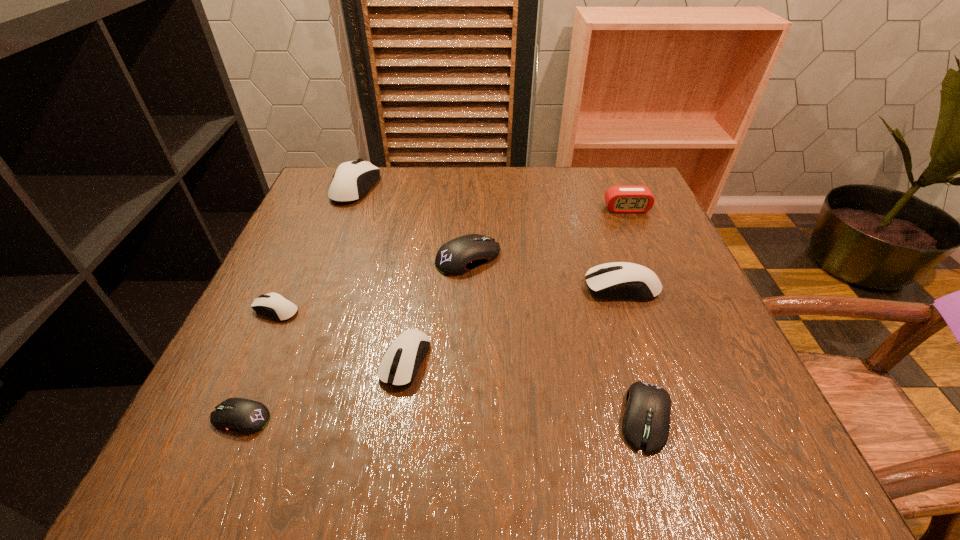
The image size is (960, 540). What are the coordinates of `alarm clock that is at the far edge` in the screenshot? It's located at (619, 199).

Identify the location of alarm clock at the right edge. This screenshot has width=960, height=540. (619, 199).

Image resolution: width=960 pixels, height=540 pixels. I want to click on object that is positioned at the far left corner, so click(x=352, y=180).

Find the location of a particular element. This screenshot has height=540, width=960. object that is at the near left corner is located at coordinates (245, 416).

In order to click on object that is at the far right corner in this screenshot , I will do `click(619, 199)`.

Find the location of a particular element. The width and height of the screenshot is (960, 540). object located in the near right corner section of the desktop is located at coordinates 646,422.

The image size is (960, 540). I want to click on free space at the far edge of the desktop, so tap(413, 199).

This screenshot has width=960, height=540. In the image, there is a desktop. Identify the location of vacant space at the near edge. (620, 417).

At what (x,y) coordinates should I click in order to perform the action: click on vacant area at the left edge of the desktop. Please return your answer as a coordinate pair (x, y). The image size is (960, 540). Looking at the image, I should click on (207, 414).

What are the coordinates of `vacant space at the right edge of the desktop` in the screenshot? It's located at (657, 227).